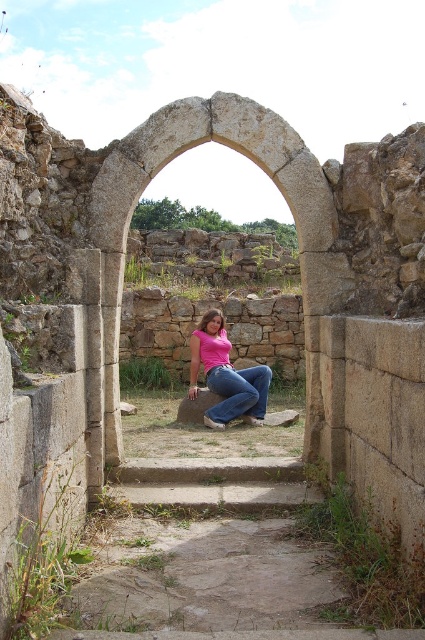
Question: Is pink matte shirt at center smaller than denim jeans at center?

Choices:
 (A) yes
 (B) no

Answer: (B)

Question: Which point is farther to the camera?

Choices:
 (A) pink matte shirt at center
 (B) denim jeans at center
 (C) gray concrete stairs at center

Answer: (B)

Question: Is the position of gray concrete stairs at center more distant than that of denim jeans at center?

Choices:
 (A) no
 (B) yes

Answer: (A)

Question: Which object appears closest to the camera in this image?

Choices:
 (A) gray concrete stairs at center
 (B) pink matte shirt at center
 (C) denim jeans at center

Answer: (A)

Question: Is gray concrete stairs at center behind pink matte shirt at center?

Choices:
 (A) no
 (B) yes

Answer: (A)

Question: Among these objects, which one is farthest from the camera?

Choices:
 (A) pink matte shirt at center
 (B) gray concrete stairs at center

Answer: (A)